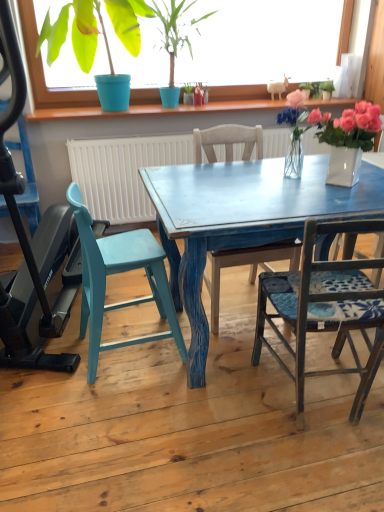
What do you see at coordinates (75, 34) in the screenshot? I see `green matte plant at upper left, the 1th houseplant from the left` at bounding box center [75, 34].

What is the approximate height of teal painted wood chair at left, which is counted as the third chair, starting from the right?

teal painted wood chair at left, which is counted as the third chair, starting from the right, is 77.12 centimeters in height.

What do you see at coordinates (119, 272) in the screenshot? The image size is (384, 512). I see `teal painted wood chair at left, which is the 1th chair from left to right` at bounding box center [119, 272].

What do you see at coordinates (295, 132) in the screenshot? I see `translucent glass vase at center` at bounding box center [295, 132].

What do you see at coordinates (250, 267) in the screenshot?
I see `wooden chair at center, which is counted as the 2th chair, starting from the right` at bounding box center [250, 267].

Describe the element at coordinates (325, 309) in the screenshot. I see `wooden chair with blue patterned cushion at right, the 3th chair in the left-to-right sequence` at that location.

This screenshot has width=384, height=512. What are the coordinates of `green matte plant at upper center, the 1th houseplant viewed from the right` in the screenshot? It's located at (175, 31).

The width and height of the screenshot is (384, 512). Find the location of `green matte plant at upper left, the 1th houseplant from the left`. green matte plant at upper left, the 1th houseplant from the left is located at coordinates (75, 34).

Is wooden chair with blue patterned cushion at right, positioned as the first chair in right-to-left order, situated inside green matte plant at upper left, which is counted as the second houseplant, starting from the right, or outside?

wooden chair with blue patterned cushion at right, positioned as the first chair in right-to-left order, cannot be found inside green matte plant at upper left, which is counted as the second houseplant, starting from the right.

Considering the sizes of objects wooden chair with blue patterned cushion at right, the 3th chair in the left-to-right sequence, and green matte plant at upper left, the 1th houseplant from the left, in the image provided, who is taller, wooden chair with blue patterned cushion at right, the 3th chair in the left-to-right sequence, or green matte plant at upper left, the 1th houseplant from the left,?

wooden chair with blue patterned cushion at right, the 3th chair in the left-to-right sequence.

Is wooden chair with blue patterned cushion at right, positioned as the first chair in right-to-left order, aimed at green matte plant at upper left, the 1th houseplant from the left?

No, wooden chair with blue patterned cushion at right, positioned as the first chair in right-to-left order, is not turned towards green matte plant at upper left, the 1th houseplant from the left.

Which is in front, teal painted wood chair at left, which is the 1th chair from left to right, or wooden chair at center, which is the second chair in left-to-right order?

Positioned in front is teal painted wood chair at left, which is the 1th chair from left to right.

Between teal painted wood chair at left, which is the 1th chair from left to right, and wooden chair at center, which is counted as the 2th chair, starting from the right, which one has less height?

With less height is teal painted wood chair at left, which is the 1th chair from left to right.

Is teal painted wood chair at left, which is the 1th chair from left to right, bigger than wooden chair at center, which is the second chair in left-to-right order?

Actually, teal painted wood chair at left, which is the 1th chair from left to right, might be smaller than wooden chair at center, which is the second chair in left-to-right order.

Which object is thinner, teal painted wood chair at left, which is the 1th chair from left to right, or wooden chair at center, which is counted as the 2th chair, starting from the right?

teal painted wood chair at left, which is the 1th chair from left to right.

Considering the relative sizes of wooden chair with blue patterned cushion at right, the 3th chair in the left-to-right sequence, and green matte plant at upper center, the 2th houseplant when ordered from left to right, in the image provided, is wooden chair with blue patterned cushion at right, the 3th chair in the left-to-right sequence, wider than green matte plant at upper center, the 2th houseplant when ordered from left to right,?

Indeed, wooden chair with blue patterned cushion at right, the 3th chair in the left-to-right sequence, has a greater width compared to green matte plant at upper center, the 2th houseplant when ordered from left to right.

Considering the positions of points (304, 265) and (166, 105), is point (304, 265) closer to camera compared to point (166, 105)?

Yes, it is in front of point (166, 105).

From the image's perspective, between wooden chair with blue patterned cushion at right, the 3th chair in the left-to-right sequence, and green matte plant at upper center, the 2th houseplant when ordered from left to right, who is located below?

wooden chair with blue patterned cushion at right, the 3th chair in the left-to-right sequence, is shown below in the image.

Is wooden chair with blue patterned cushion at right, positioned as the first chair in right-to-left order, in front of or behind green matte plant at upper center, the 2th houseplant when ordered from left to right, in the image?

wooden chair with blue patterned cushion at right, positioned as the first chair in right-to-left order, is in front of green matte plant at upper center, the 2th houseplant when ordered from left to right.

Is teal painted wood chair at left, which is the 1th chair from left to right, located outside green matte plant at upper left, which is counted as the second houseplant, starting from the right?

Yes, teal painted wood chair at left, which is the 1th chair from left to right, is outside of green matte plant at upper left, which is counted as the second houseplant, starting from the right.

Can you confirm if teal painted wood chair at left, which is the 1th chair from left to right, is thinner than green matte plant at upper left, which is counted as the second houseplant, starting from the right?

Indeed, teal painted wood chair at left, which is the 1th chair from left to right, has a lesser width compared to green matte plant at upper left, which is counted as the second houseplant, starting from the right.

Considering the positions of objects teal painted wood chair at left, which is the 1th chair from left to right, and green matte plant at upper left, the 1th houseplant from the left, in the image provided, who is more to the left, teal painted wood chair at left, which is the 1th chair from left to right, or green matte plant at upper left, the 1th houseplant from the left,?

green matte plant at upper left, the 1th houseplant from the left, is more to the left.

Is teal painted wood chair at left, which is counted as the third chair, starting from the right, smaller than green matte plant at upper left, the 1th houseplant from the left?

Indeed, teal painted wood chair at left, which is counted as the third chair, starting from the right, has a smaller size compared to green matte plant at upper left, the 1th houseplant from the left.

From a real-world perspective, does wooden chair at center, which is counted as the 2th chair, starting from the right, stand above green matte plant at upper left, which is counted as the second houseplant, starting from the right?

No, from a real-world perspective, wooden chair at center, which is counted as the 2th chair, starting from the right, is not over green matte plant at upper left, which is counted as the second houseplant, starting from the right

Considering the positions of objects wooden chair at center, which is the second chair in left-to-right order, and green matte plant at upper left, the 1th houseplant from the left, in the image provided, who is more to the left, wooden chair at center, which is the second chair in left-to-right order, or green matte plant at upper left, the 1th houseplant from the left,?

From the viewer's perspective, green matte plant at upper left, the 1th houseplant from the left, appears more on the left side.

From the image's perspective, is wooden chair at center, which is the second chair in left-to-right order, located above or below green matte plant at upper left, the 1th houseplant from the left?

Clearly, from the image's perspective, wooden chair at center, which is the second chair in left-to-right order, is below green matte plant at upper left, the 1th houseplant from the left.

Who is more distant, wooden chair at center, which is the second chair in left-to-right order, or green matte plant at upper center, the 2th houseplant when ordered from left to right?

green matte plant at upper center, the 2th houseplant when ordered from left to right, is further away from the camera.

From a real-world perspective, is wooden chair at center, which is counted as the 2th chair, starting from the right, on green matte plant at upper center, the 1th houseplant viewed from the right?

No, from a real-world perspective, wooden chair at center, which is counted as the 2th chair, starting from the right, is not over green matte plant at upper center, the 1th houseplant viewed from the right

Who is bigger, wooden chair at center, which is counted as the 2th chair, starting from the right, or green matte plant at upper center, the 2th houseplant when ordered from left to right?

wooden chair at center, which is counted as the 2th chair, starting from the right, is bigger.

What's the angular difference between wooden chair at center, which is the second chair in left-to-right order, and green matte plant at upper center, the 2th houseplant when ordered from left to right,'s facing directions?

The angle between the facing direction of wooden chair at center, which is the second chair in left-to-right order, and the facing direction of green matte plant at upper center, the 2th houseplant when ordered from left to right, is 1.76 degrees.

Is teal plastic baby carriage at left positioned beyond the bounds of green matte plant at upper center, the 2th houseplant when ordered from left to right?

That's correct, teal plastic baby carriage at left is outside of green matte plant at upper center, the 2th houseplant when ordered from left to right.

Identify the location of the 2nd houseplant located above the teal plastic baby carriage at left (from a real-world perspective). The width and height of the screenshot is (384, 512). (175, 31).

Could you measure the distance between teal plastic baby carriage at left and green matte plant at upper center, the 2th houseplant when ordered from left to right?

The distance of teal plastic baby carriage at left from green matte plant at upper center, the 2th houseplant when ordered from left to right, is 5.14 feet.

Is point (54, 307) less distant than point (189, 25)?

That is True.

Find the location of a particular element. houseplant that is the 2nd one when counting leftward from the wooden chair with blue patterned cushion at right, the 3th chair in the left-to-right sequence is located at coordinates (75, 34).

The width and height of the screenshot is (384, 512). Find the location of `chair above the teal painted wood chair at left, which is the 1th chair from left to right (from the image's perspective)`. chair above the teal painted wood chair at left, which is the 1th chair from left to right (from the image's perspective) is located at coordinates (250, 267).

From the image, which object appears to be nearer to teal painted wood chair at left, which is counted as the third chair, starting from the right, wooden chair at center, which is counted as the 2th chair, starting from the right, or green matte plant at upper center, the 2th houseplant when ordered from left to right?

Among the two, wooden chair at center, which is counted as the 2th chair, starting from the right, is located nearer to teal painted wood chair at left, which is counted as the third chair, starting from the right.

Looking at the image, which one is located further to translucent glass vase at center, teal plastic baby carriage at left or teal painted wood chair at left, which is the 1th chair from left to right?

teal plastic baby carriage at left is further to translucent glass vase at center.

Looking at the image, which one is located further to green matte plant at upper left, the 1th houseplant from the left, wooden chair at center, which is the second chair in left-to-right order, or teal painted wood chair at left, which is counted as the third chair, starting from the right?

teal painted wood chair at left, which is counted as the third chair, starting from the right.

Looking at this image, estimate the real-world distances between objects in this image. Which object is closer to translucent glass vase at center, wooden chair at center, which is the second chair in left-to-right order, or green matte plant at upper left, the 1th houseplant from the left?

wooden chair at center, which is the second chair in left-to-right order, is closer to translucent glass vase at center.

Looking at the image, which one is located closer to teal painted wood chair at left, which is counted as the third chair, starting from the right, green matte plant at upper left, the 1th houseplant from the left, or wooden chair with blue patterned cushion at right, the 3th chair in the left-to-right sequence?

wooden chair with blue patterned cushion at right, the 3th chair in the left-to-right sequence, is closer to teal painted wood chair at left, which is counted as the third chair, starting from the right.

Considering their positions, is translucent glass vase at center positioned closer to green matte plant at upper center, the 1th houseplant viewed from the right, than wooden chair with blue patterned cushion at right, positioned as the first chair in right-to-left order?

Among the two, translucent glass vase at center is located nearer to green matte plant at upper center, the 1th houseplant viewed from the right.

Looking at the image, which one is located further to green matte plant at upper center, the 2th houseplant when ordered from left to right, translucent glass vase at center or teal plastic baby carriage at left?

teal plastic baby carriage at left is further to green matte plant at upper center, the 2th houseplant when ordered from left to right.

Looking at the image, which one is located closer to wooden chair at center, which is counted as the 2th chair, starting from the right, teal painted wood chair at left, which is counted as the third chair, starting from the right, or translucent glass vase at center?

translucent glass vase at center lies closer to wooden chair at center, which is counted as the 2th chair, starting from the right, than the other object.

Locate an element on the screen. The height and width of the screenshot is (512, 384). chair located between teal painted wood chair at left, which is the 1th chair from left to right, and translucent glass vase at center in the left-right direction is located at coordinates (250, 267).

This screenshot has height=512, width=384. I want to click on floral arrangement between teal plastic baby carriage at left and green matte plant at upper center, the 1th houseplant viewed from the right, along the z-axis, so click(x=295, y=132).

You are a GUI agent. You are given a task and a screenshot of the screen. Output one action in this format:
    pyautogui.click(x=<x>, y=<y>)
    Task: Click on the floral arrangement situated between teal plastic baby carriage at left and wooden chair with blue patterned cushion at right, the 3th chair in the left-to-right sequence, from left to right
    
    Given the screenshot: What is the action you would take?
    pyautogui.click(x=295, y=132)

Locate an element on the screen. Image resolution: width=384 pixels, height=512 pixels. chair situated between teal painted wood chair at left, which is the 1th chair from left to right, and wooden chair with blue patterned cushion at right, positioned as the first chair in right-to-left order, from left to right is located at coordinates (250, 267).